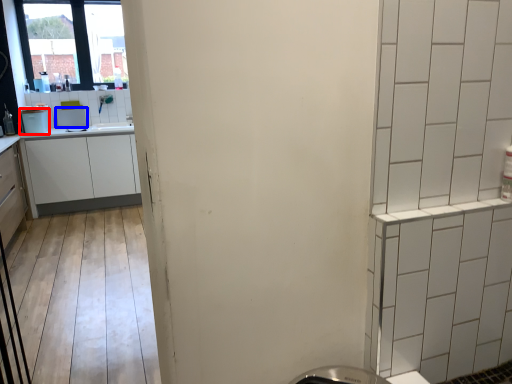
Question: Among these objects, which one is nearest to the camera, appliance (highlighted by a red box) or appliance (highlighted by a blue box)?

Choices:
 (A) appliance
 (B) appliance

Answer: (A)